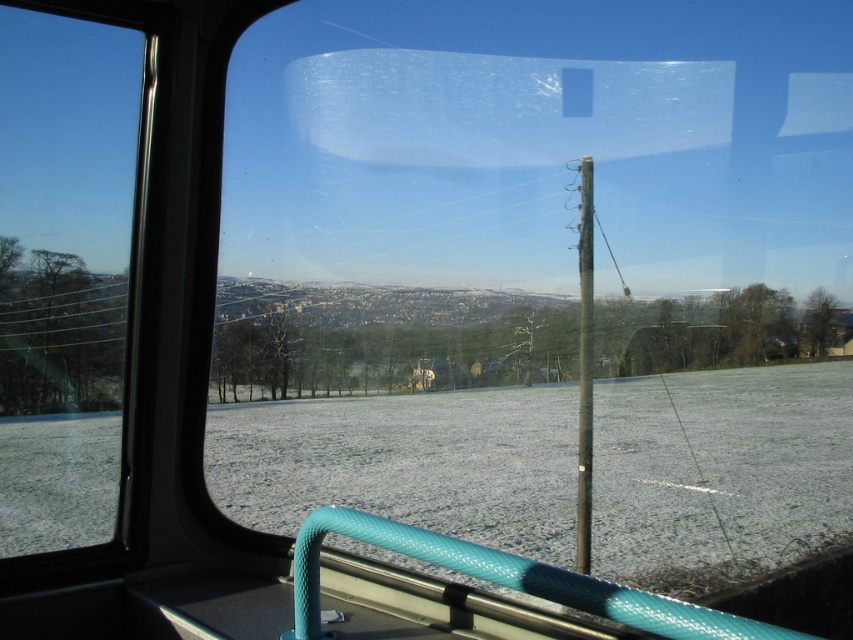
You are inside a vehicle and want to know how far the point at coordinates [70,65] is from you. Can you determine the distance?

Answer: The distance between the point at coordinates [70,65] and the viewer is 27.61 meters.

You are sitting in the vehicle and want to look out the transparent glass window at left. However, you notice the metallic pole at center might be blocking your view. Is the window in front of or behind the pole?

The transparent glass window at left is in front of the metallic pole at center, so it is not blocking your view but actually positioned in front, meaning you can see through the window without obstruction from the pole.